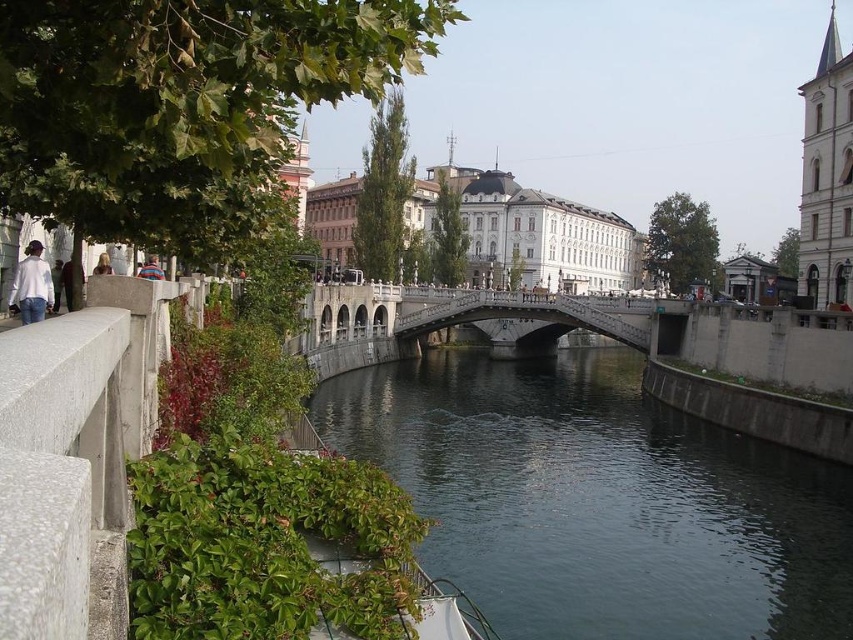
You are standing on the sidewalk and see the green concrete river at center and the white matte shirt at left. Which object is closer to your right side?

The green concrete river at center is closer to your right side because it is positioned to the right of the white matte shirt at left.

You are a photographer standing on the left side of the canal. You want to capture a photo of the green concrete river at center and the white matte shirt at left. Which object is closer to the camera?

The white matte shirt at left is closer to the camera because the green concrete river at center is positioned under it, indicating it is behind.